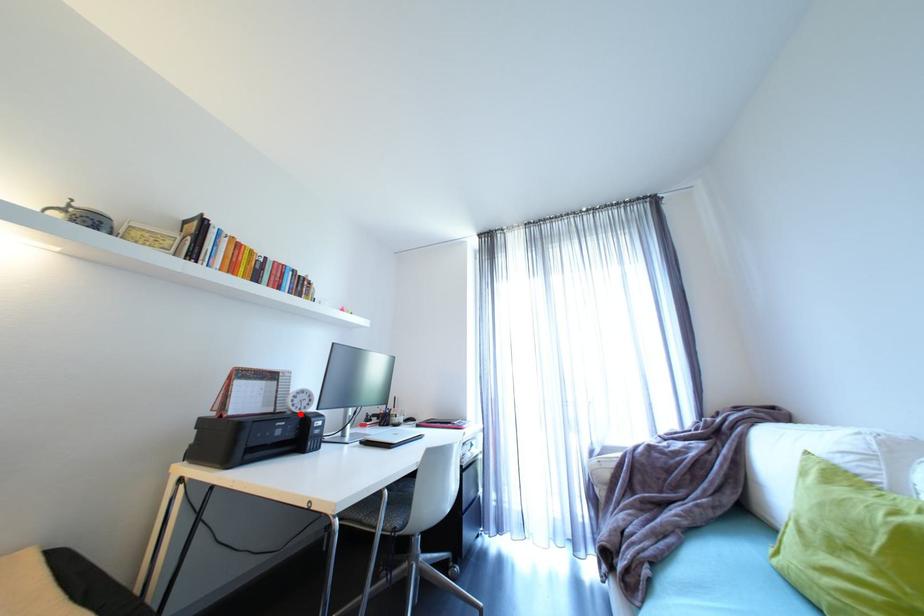
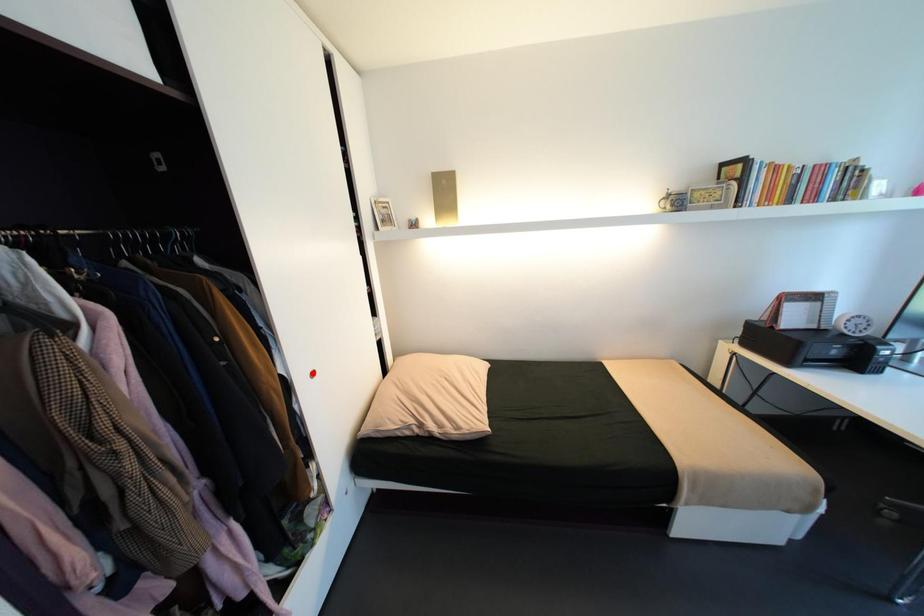
I am providing you with two images of the same scene from different viewpoints. A red point is marked on the first image and another point is marked on the second image. Does the point marked in image1 correspond to the same location as the one in image2?

No